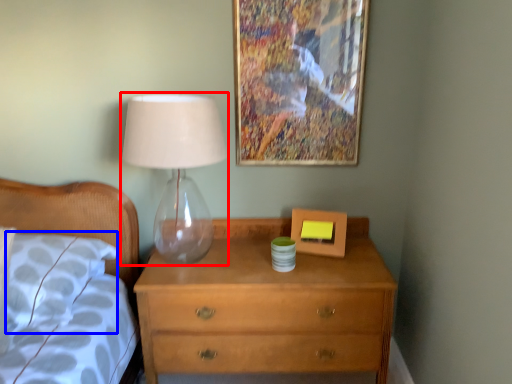
Question: Which object appears closest to the camera in this image, table lamp (highlighted by a red box) or pillow (highlighted by a blue box)?

Choices:
 (A) table lamp
 (B) pillow

Answer: (A)